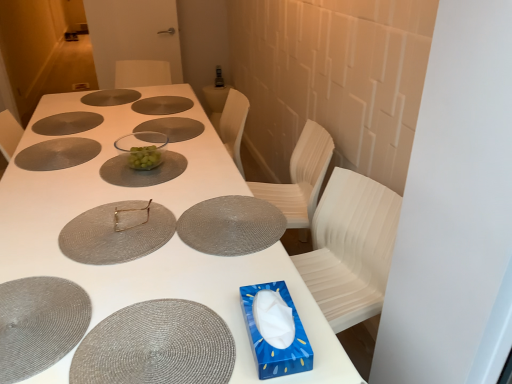
You are a GUI agent. You are given a task and a screenshot of the screen. Output one action in this format:
    pyautogui.click(x=<x>, y=<y>)
    Task: Click on the free space in front of transparent glass bowl at center, the fourth glass plate viewed from the back
    The image size is (512, 384).
    Given the screenshot: What is the action you would take?
    pyautogui.click(x=148, y=146)